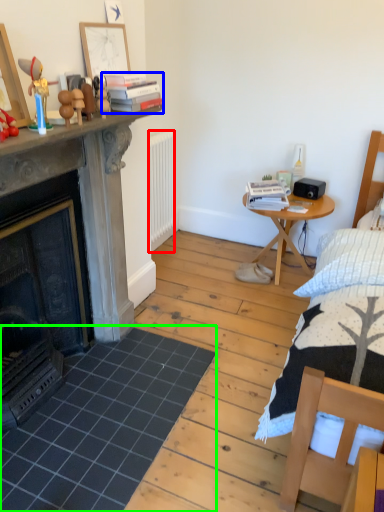
Question: Based on their relative distances, which object is nearer to radiator (highlighted by a red box)? Choose from book (highlighted by a blue box) and tile (highlighted by a green box).

Choices:
 (A) book
 (B) tile

Answer: (A)